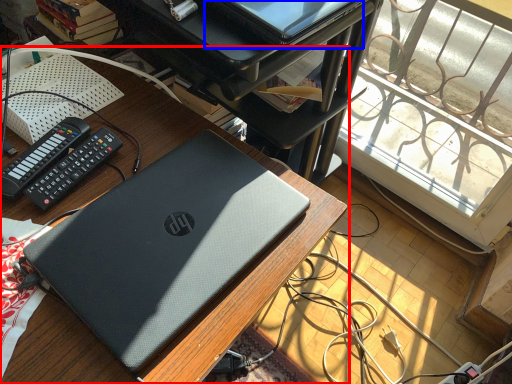
Question: Which object is further to the camera taking this photo, desk (highlighted by a red box) or computer (highlighted by a blue box)?

Choices:
 (A) desk
 (B) computer

Answer: (B)